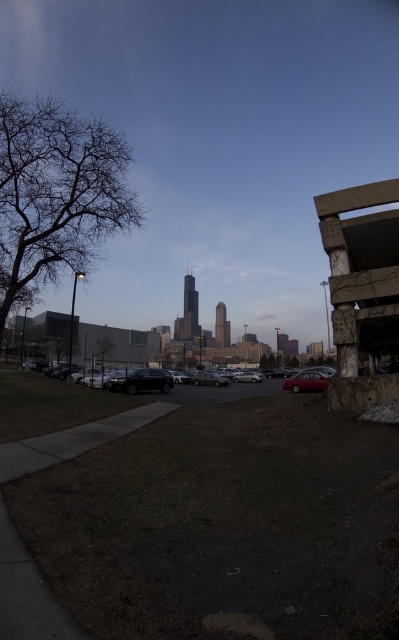
Between brown dirt at lower center and green leafy tree at center-left, which one appears on the right side from the viewer's perspective?

brown dirt at lower center is more to the right.

Can you confirm if brown dirt at lower center is positioned above green leafy tree at center-left?

Correct, brown dirt at lower center is located above green leafy tree at center-left.

This screenshot has width=399, height=640. Find the location of `brown dirt at lower center`. brown dirt at lower center is located at coordinates (225, 525).

This screenshot has height=640, width=399. In order to click on brown dirt at lower center in this screenshot , I will do `click(225, 525)`.

Is point (63, 257) positioned in front of point (319, 388)?

Yes, it is.

Between bare branches at left and matte red sedan at center-right, which one is positioned higher?

Positioned higher is bare branches at left.

Does point (92, 253) lie behind point (312, 387)?

No, it is in front of (312, 387).

In order to click on bare branches at left in this screenshot , I will do `click(55, 195)`.

Does metallic gray cars at center have a greater height compared to matte red sedan at center-right?

Yes, metallic gray cars at center is taller than matte red sedan at center-right.

Looking at this image, who is positioned more to the left, metallic gray cars at center or matte red sedan at center-right?

Positioned to the left is metallic gray cars at center.

Image resolution: width=399 pixels, height=640 pixels. Find the location of `metallic gray cars at center`. metallic gray cars at center is located at coordinates (223, 392).